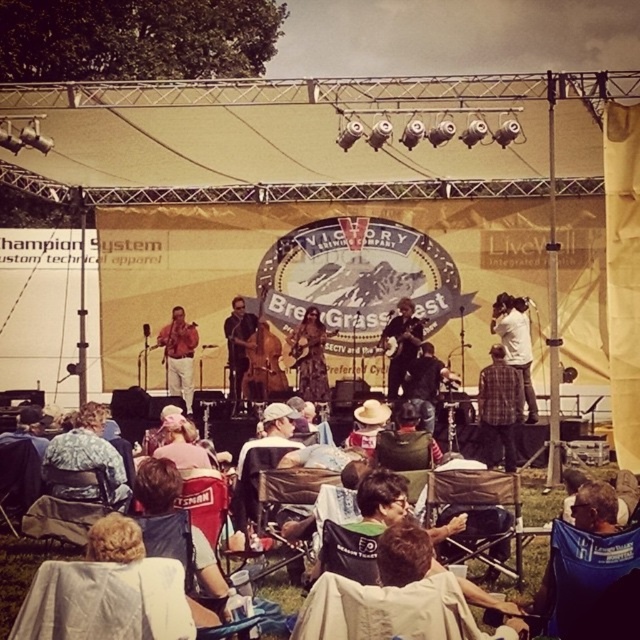
Question: Which object is closer to the camera taking this photo?

Choices:
 (A) plaid shirt at center
 (B) matte brown guitar at center

Answer: (A)

Question: Is fluffy fabric hat at lower left bigger than shiny brown guitar at center?

Choices:
 (A) yes
 (B) no

Answer: (A)

Question: Which point is closer to the camera?

Choices:
 (A) dark brown leather jacket at center
 (B) fluffy fabric hat at lower left
 (C) matte brown shirt at center

Answer: (B)

Question: Does plaid shirt at center have a larger size compared to dark brown leather jacket at center?

Choices:
 (A) no
 (B) yes

Answer: (A)

Question: Which object is positioned closest to the fluffy fabric hat at lower left?

Choices:
 (A) shiny black guitar at center
 (B) matte brown shirt at center
 (C) white shirt at upper center

Answer: (B)

Question: Is fluffy fabric hat at lower left closer to camera compared to plaid shirt at center?

Choices:
 (A) no
 (B) yes

Answer: (B)